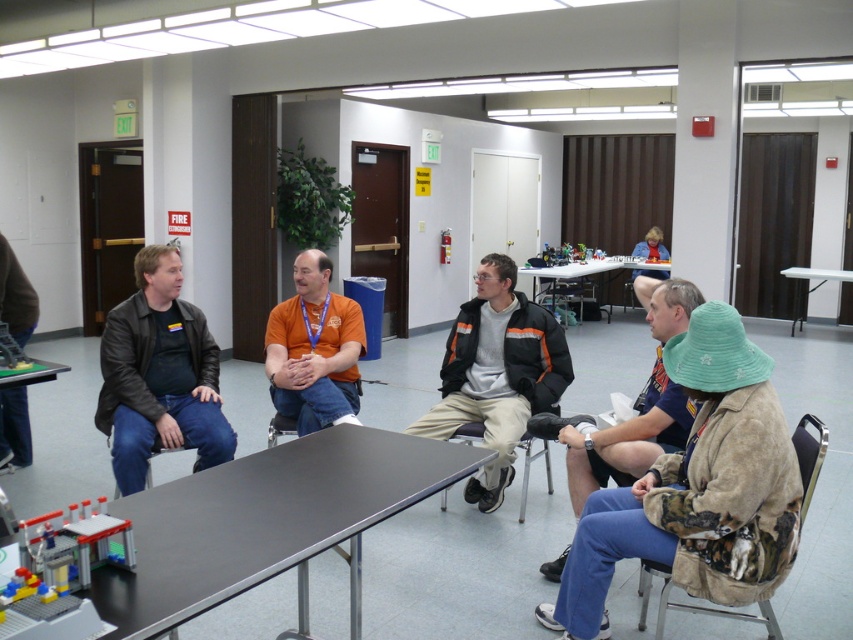
What do you see at coordinates (642, 404) in the screenshot? The image size is (853, 640). I see `camouflage jacket at lower right` at bounding box center [642, 404].

Which is below, camouflage jacket at lower right or matte plastic chair at lower left?

matte plastic chair at lower left is lower down.

I want to click on camouflage jacket at lower right, so click(642, 404).

Find the location of a particular element. This screenshot has width=853, height=640. camouflage jacket at lower right is located at coordinates (642, 404).

Is black metal table at lower left bigger than white plastic table at right?

No.

Is the position of black metal table at lower left less distant than that of white plastic table at right?

Yes, it is in front of white plastic table at right.

Who is more distant from viewer, (358, 522) or (834, 280)?

The point (834, 280) is more distant.

Identify the location of black metal table at lower left. The height and width of the screenshot is (640, 853). (265, 524).

Is camo fabric jacket at lower right wider than white plastic table at right?

Incorrect, camo fabric jacket at lower right's width does not surpass white plastic table at right's.

Describe the element at coordinates (691, 604) in the screenshot. The width and height of the screenshot is (853, 640). I see `camo fabric jacket at lower right` at that location.

Where is `camo fabric jacket at lower right`? The height and width of the screenshot is (640, 853). camo fabric jacket at lower right is located at coordinates (691, 604).